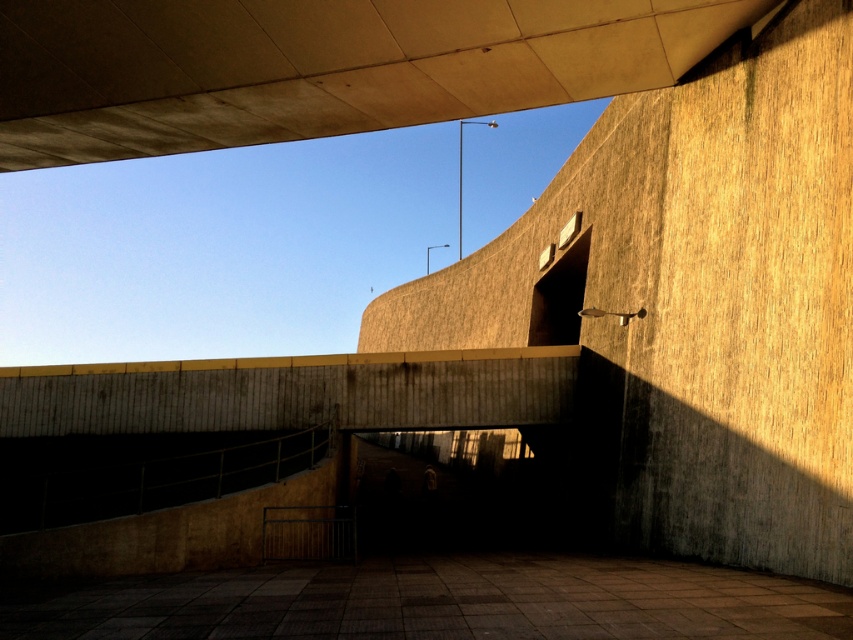
You are a construction worker assessing the structural integrity of the overpass. You notice two key components in the image. Which component is larger in size between the concrete ceiling at upper center and the brown concrete at center?

The concrete ceiling at upper center is larger in size compared to the brown concrete at center according to the description.